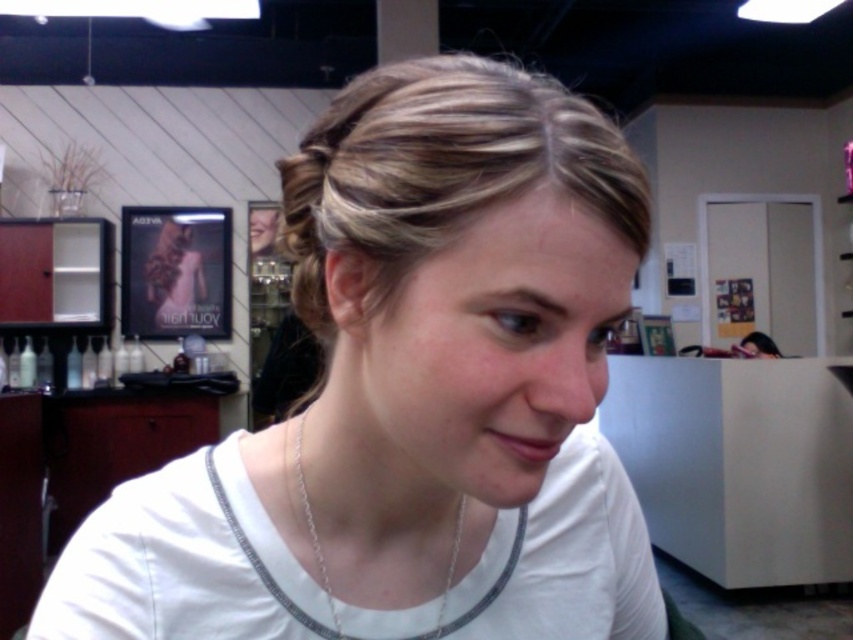
Question: Which point is farther from the camera taking this photo?

Choices:
 (A) (294, 452)
 (B) (444, 198)

Answer: (A)

Question: Estimate the real-world distances between objects in this image. Which object is closer to the white fabric shirt at center?

Choices:
 (A) silver chain necklace at lower center
 (B) blonde smooth hair at center

Answer: (B)

Question: Does white fabric shirt at center appear over silver chain necklace at lower center?

Choices:
 (A) yes
 (B) no

Answer: (A)

Question: From the image, what is the correct spatial relationship of white fabric shirt at center in relation to silver chain necklace at lower center?

Choices:
 (A) right
 (B) left

Answer: (A)

Question: Considering the real-world distances, which object is farthest from the silver chain necklace at lower center?

Choices:
 (A) white fabric shirt at center
 (B) blonde smooth hair at center

Answer: (B)

Question: Does white fabric shirt at center have a larger size compared to blonde smooth hair at center?

Choices:
 (A) yes
 (B) no

Answer: (A)